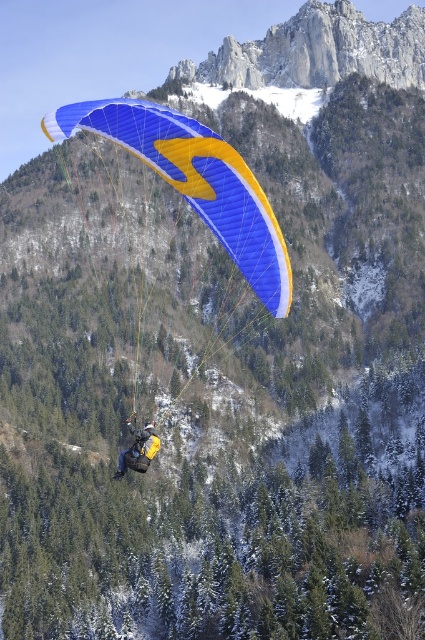
Question: Which object is farther from the camera taking this photo?

Choices:
 (A) yellow fabric parachute at center
 (B) blue fabric parachute at center

Answer: (A)

Question: Is blue fabric parachute at center wider than yellow fabric parachute at center?

Choices:
 (A) no
 (B) yes

Answer: (B)

Question: Does blue fabric parachute at center lie behind yellow fabric parachute at center?

Choices:
 (A) yes
 (B) no

Answer: (B)

Question: Which point is farther to the camera?

Choices:
 (A) blue fabric parachute at center
 (B) yellow fabric parachute at center

Answer: (B)

Question: Is blue fabric parachute at center in front of yellow fabric parachute at center?

Choices:
 (A) no
 (B) yes

Answer: (B)